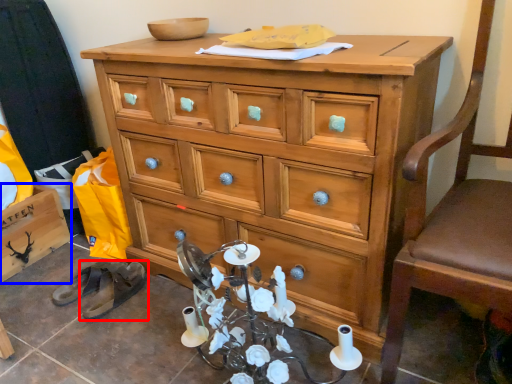
Question: Which object appears farthest to the camera in this image, footwear (highlighted by a red box) or cabinetry (highlighted by a blue box)?

Choices:
 (A) footwear
 (B) cabinetry

Answer: (B)